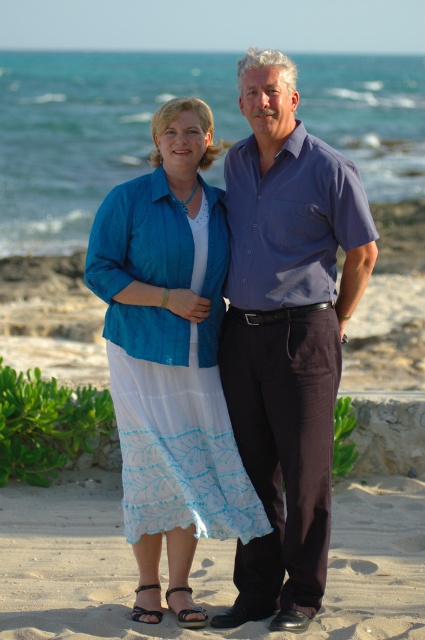
Is purple cotton shirt at center wider than matte blue blouse at center?

No.

Can you confirm if purple cotton shirt at center is thinner than matte blue blouse at center?

Yes.

Who is more distant from viewer, (238,273) or (201,486)?

Positioned behind is point (238,273).

You are a GUI agent. You are given a task and a screenshot of the screen. Output one action in this format:
    pyautogui.click(x=<x>, y=<y>)
    Task: Click on the purple cotton shirt at center
    
    Given the screenshot: What is the action you would take?
    [286, 333]

Is purple cotton shirt at center smaller than sandy at lower center?

Correct, purple cotton shirt at center occupies less space than sandy at lower center.

Is point (305, 474) more distant than point (78, 598)?

No, it is in front of (78, 598).

Who is more distant from viewer, (337, 376) or (113, 577)?

The point (113, 577) is behind.

Locate an element on the screen. Image resolution: width=425 pixels, height=640 pixels. purple cotton shirt at center is located at coordinates (286, 333).

Between matte blue blouse at center and sandy at lower center, which one is positioned higher?

matte blue blouse at center is higher up.

Is matte blue blouse at center positioned at the back of sandy at lower center?

Yes, matte blue blouse at center is further from the viewer.

This screenshot has width=425, height=640. What are the coordinates of `matte blue blouse at center` in the screenshot? It's located at (170, 358).

Where is `matte blue blouse at center`? matte blue blouse at center is located at coordinates (170, 358).